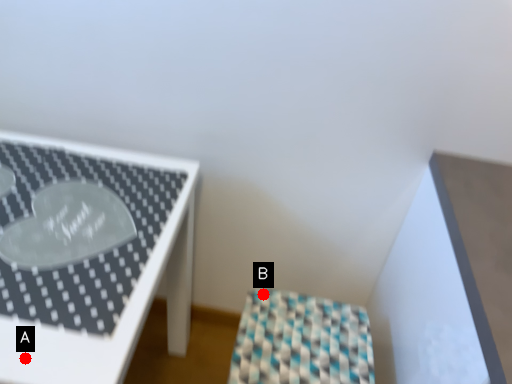
Question: Two points are circled on the image, labeled by A and B beside each circle. Among these points, which one is nearest to the camera?

Choices:
 (A) A is closer
 (B) B is closer

Answer: (A)